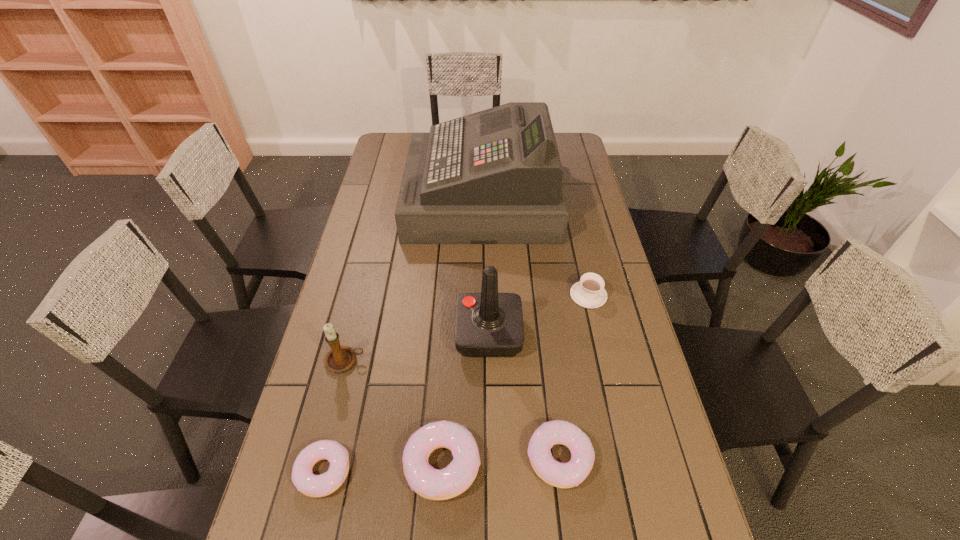
Given the evenly spaced doughnuts in the image, where should an extra doughnut be added on the right to preserve the spacing? Please point to a vacant space. Please provide its 2D coordinates. Your answer should be formatted as a tuple, i.e. [(x, y)], where the tuple contains the x and y coordinates of a point satisfying the conditions above.

[(673, 451)]